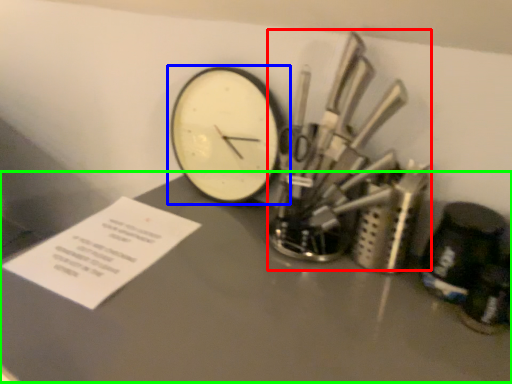
Question: Estimate the real-world distances between objects in this image. Which object is closer to tool (highlighted by a red box), wall clock (highlighted by a blue box) or table (highlighted by a green box)?

Choices:
 (A) wall clock
 (B) table

Answer: (B)